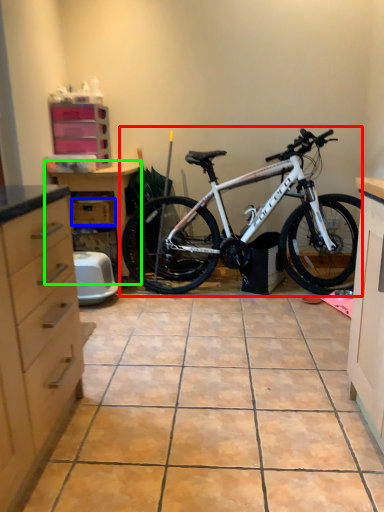
Question: Considering the real-world distances, which object is farthest from bicycle (highlighted by a red box)? drawer (highlighted by a blue box) or dresser (highlighted by a green box)?

Choices:
 (A) drawer
 (B) dresser

Answer: (A)